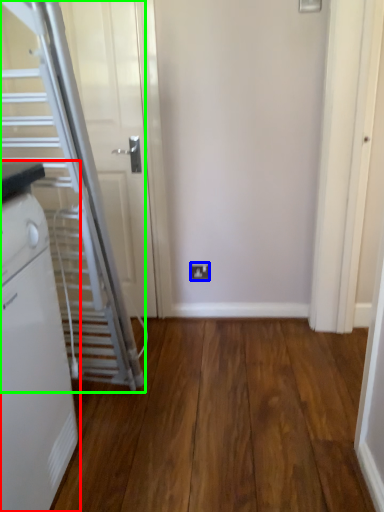
Question: Based on their relative distances, which object is farther from home appliance (highlighted by a red box)? Choose from electric outlet (highlighted by a blue box) and escalator (highlighted by a green box).

Choices:
 (A) electric outlet
 (B) escalator

Answer: (A)